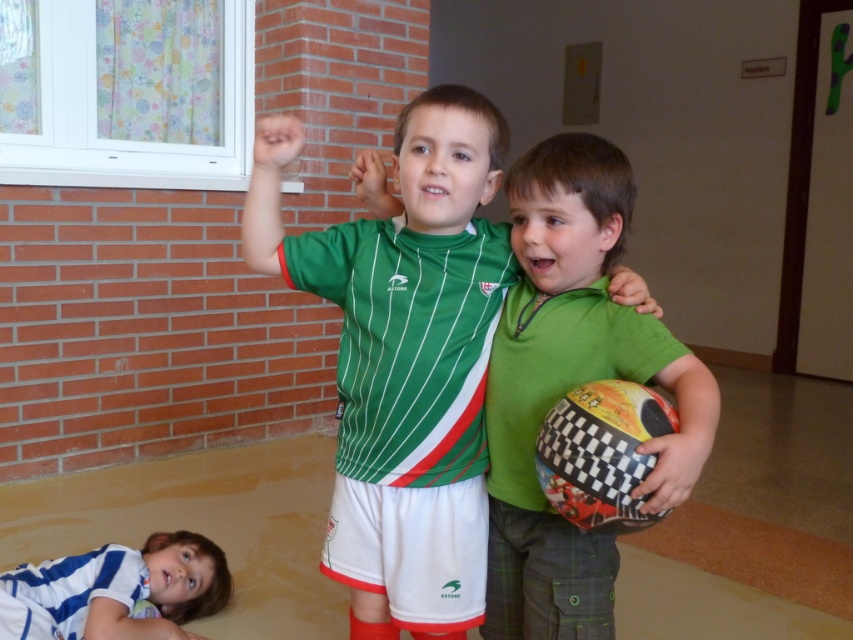
Can you confirm if green striped jersey at center is positioned above white striped shirt at lower left?

Correct, green striped jersey at center is located above white striped shirt at lower left.

Identify the location of green striped jersey at center. click(405, 355).

The image size is (853, 640). Describe the element at coordinates (405, 355) in the screenshot. I see `green striped jersey at center` at that location.

Image resolution: width=853 pixels, height=640 pixels. Find the location of `green striped jersey at center`. green striped jersey at center is located at coordinates (405, 355).

The width and height of the screenshot is (853, 640). What do you see at coordinates (405, 355) in the screenshot?
I see `green striped jersey at center` at bounding box center [405, 355].

Who is shorter, green striped jersey at center or green matte shirt at center?

green matte shirt at center

Is point (374, 588) more distant than point (663, 502)?

That is True.

You are a GUI agent. You are given a task and a screenshot of the screen. Output one action in this format:
    pyautogui.click(x=<x>, y=<y>)
    Task: Click on the green striped jersey at center
    
    Given the screenshot: What is the action you would take?
    pyautogui.click(x=405, y=355)

Does green matte shirt at center have a greater height compared to white striped shirt at lower left?

Indeed, green matte shirt at center has a greater height compared to white striped shirt at lower left.

Is green matte shirt at center behind white striped shirt at lower left?

No, it is in front of white striped shirt at lower left.

You are a GUI agent. You are given a task and a screenshot of the screen. Output one action in this format:
    pyautogui.click(x=<x>, y=<y>)
    Task: Click on the green matte shirt at center
    The width and height of the screenshot is (853, 640).
    Given the screenshot: What is the action you would take?
    pyautogui.click(x=572, y=388)